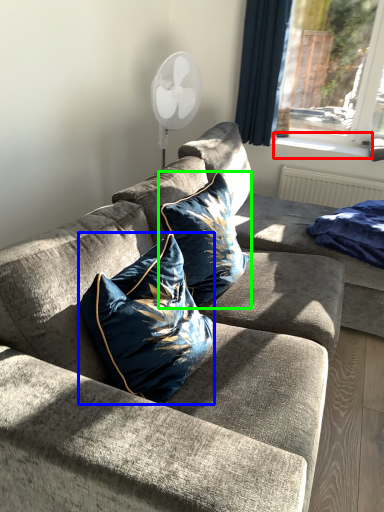
Question: Estimate the real-world distances between objects in this image. Which object is farther from window sill (highlighted by a red box), pillow (highlighted by a blue box) or pillow (highlighted by a green box)?

Choices:
 (A) pillow
 (B) pillow

Answer: (A)